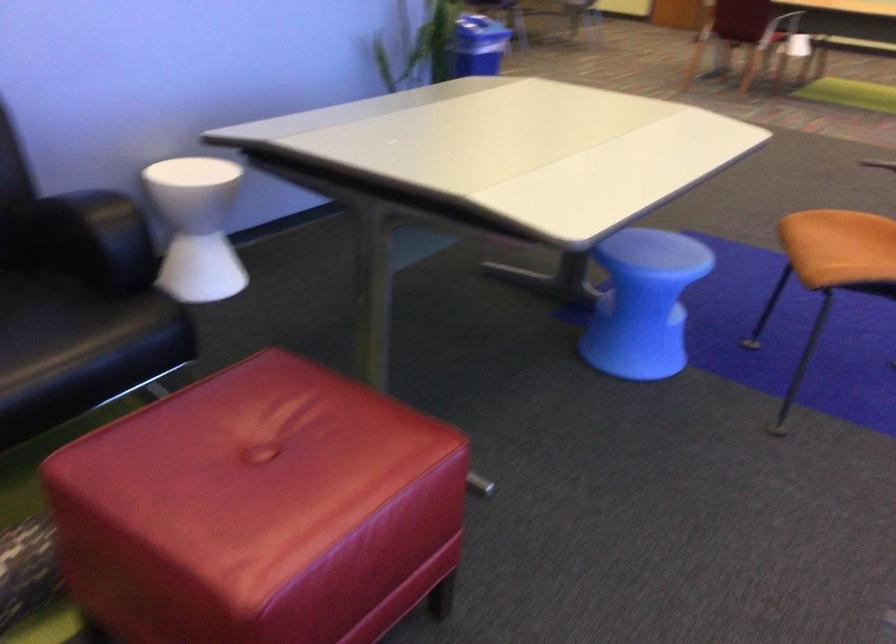
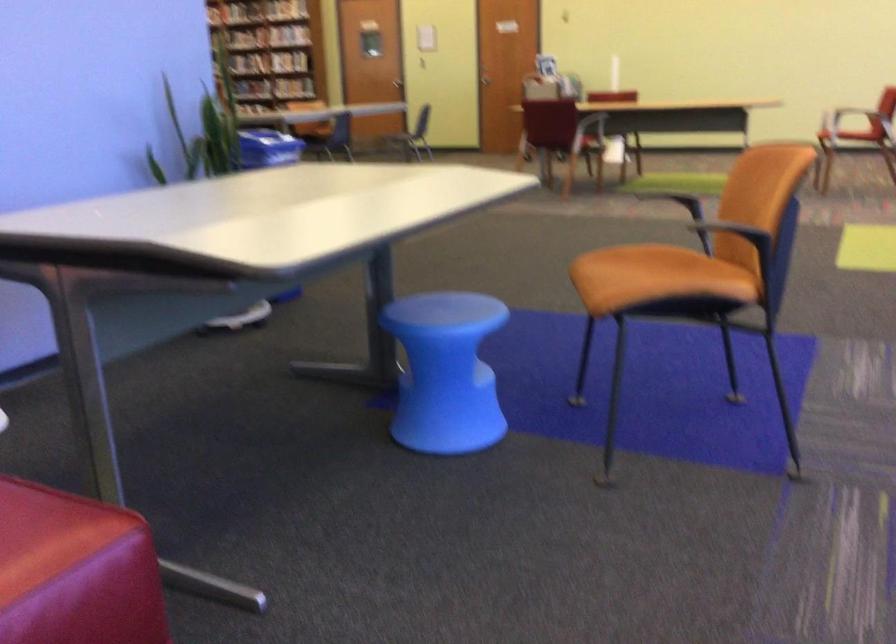
Find the pixel in the second image that matches pixel 648 307 in the first image.

(445, 372)